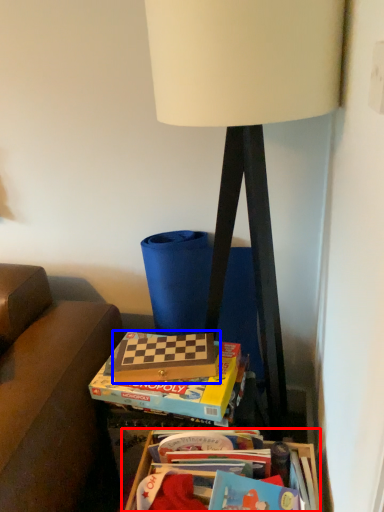
Question: Among these objects, which one is farthest to the camera, table (highlighted by a red box) or paperback book (highlighted by a blue box)?

Choices:
 (A) table
 (B) paperback book

Answer: (B)